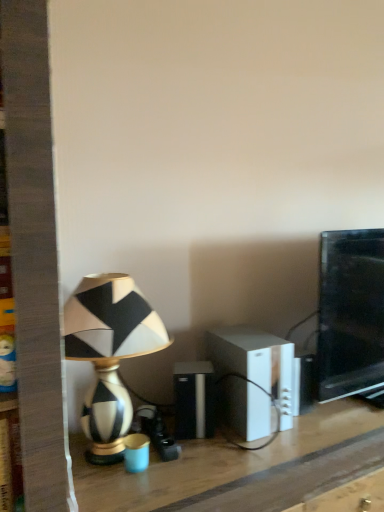
Locate an element on the screen. free location in front of black plastic speaker at center, the 2th speaker from the right is located at coordinates (203, 464).